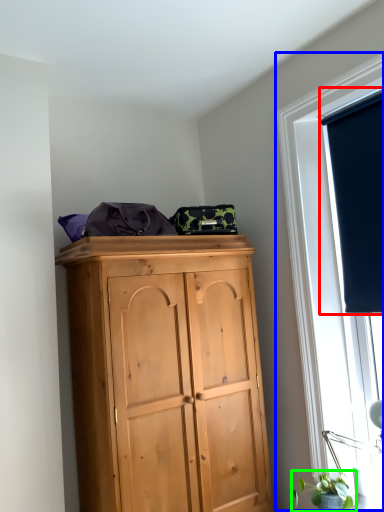
Question: Estimate the real-world distances between objects in this image. Which object is farther from window screen (highlighted by a red box), window (highlighted by a blue box) or plant (highlighted by a green box)?

Choices:
 (A) window
 (B) plant

Answer: (B)